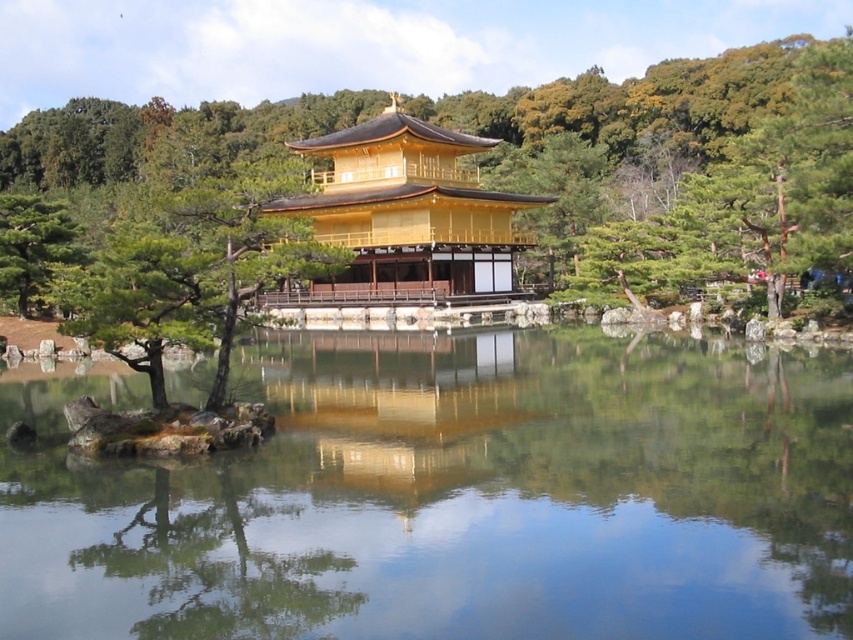
You are standing in front of the Golden Pavilion and want to take a photo of both the transparent glass water at center and the golden polished wood temple at center. Which object should you position to the left side of your camera frame to include both in the shot?

To include both the transparent glass water at center and the golden polished wood temple at center in your photo, position the golden polished wood temple at center on the left side of your camera frame since the transparent glass water at center is located to its right.

You are an artist planning to sketch the view of the green leafy tree at center and the gold reflective surface at center from the pond. Which object should you focus on first if you want to capture the larger one in your sketch?

The green leafy tree at center is larger in size than the gold reflective surface at center, so you should focus on the green leafy tree at center first to capture its larger size in your sketch.